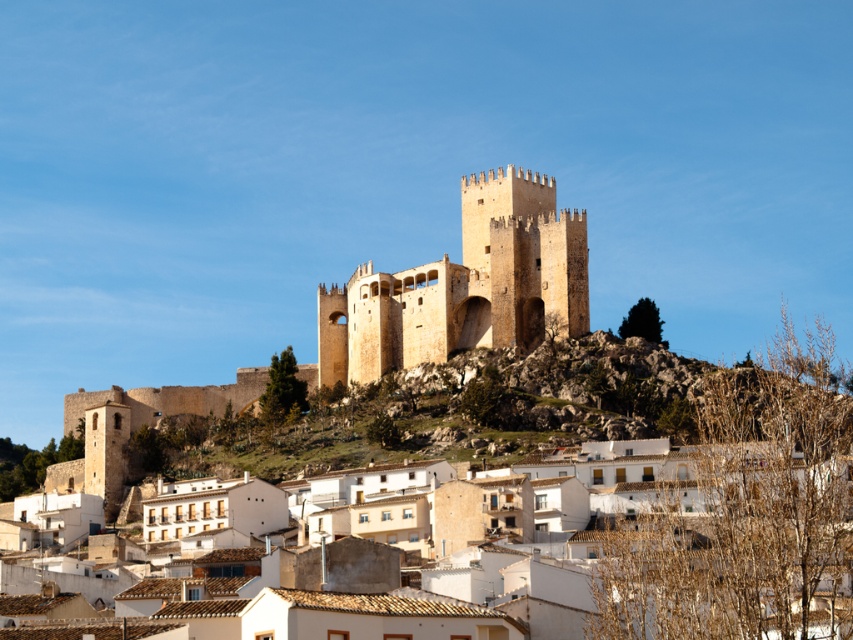
Does golden stone castle at center have a smaller size compared to light brown stone fort at center?

No, golden stone castle at center is not smaller than light brown stone fort at center.

Is golden stone castle at center positioned before light brown stone fort at center?

Yes, golden stone castle at center is in front of light brown stone fort at center.

Describe the element at coordinates (463, 288) in the screenshot. I see `golden stone castle at center` at that location.

Where is `golden stone castle at center`? golden stone castle at center is located at coordinates (463, 288).

Is point (817, 490) farther from viewer compared to point (479, 326)?

No, it is in front of (479, 326).

Does white clay houses at center have a lesser height compared to brown stone tower at center?

Yes, white clay houses at center is shorter than brown stone tower at center.

This screenshot has height=640, width=853. What do you see at coordinates (682, 589) in the screenshot?
I see `white clay houses at center` at bounding box center [682, 589].

At what (x,y) coordinates should I click in order to perform the action: click on white clay houses at center. Please return your answer as a coordinate pair (x, y). Looking at the image, I should click on (682, 589).

Measure the distance between point (509, 205) and camera.

Point (509, 205) is 489.99 feet away from camera.

What do you see at coordinates (463, 288) in the screenshot? The image size is (853, 640). I see `golden stone castle at center` at bounding box center [463, 288].

Where is `golden stone castle at center`? golden stone castle at center is located at coordinates (463, 288).